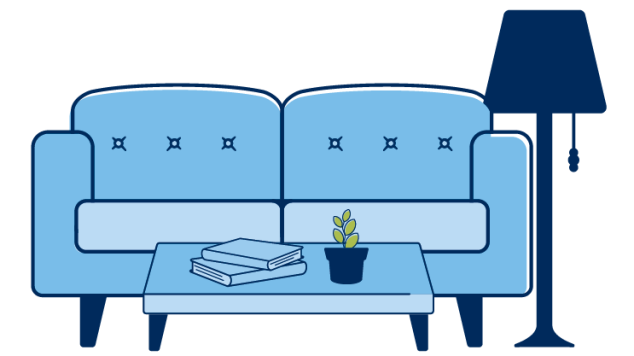
What are the coordinates of `lampshade` in the screenshot? It's located at click(534, 40).